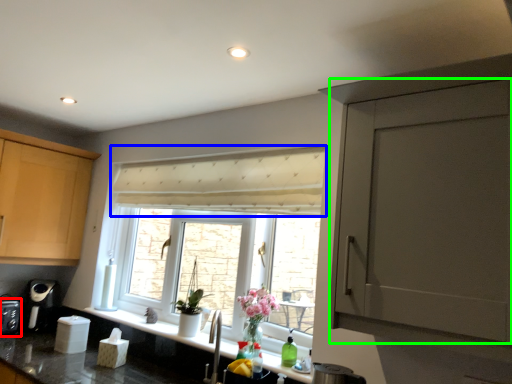
Question: Based on their relative distances, which object is nearer to appliance (highlighted by a red box)? Choose from curtain (highlighted by a blue box) and door (highlighted by a green box).

Choices:
 (A) curtain
 (B) door

Answer: (A)